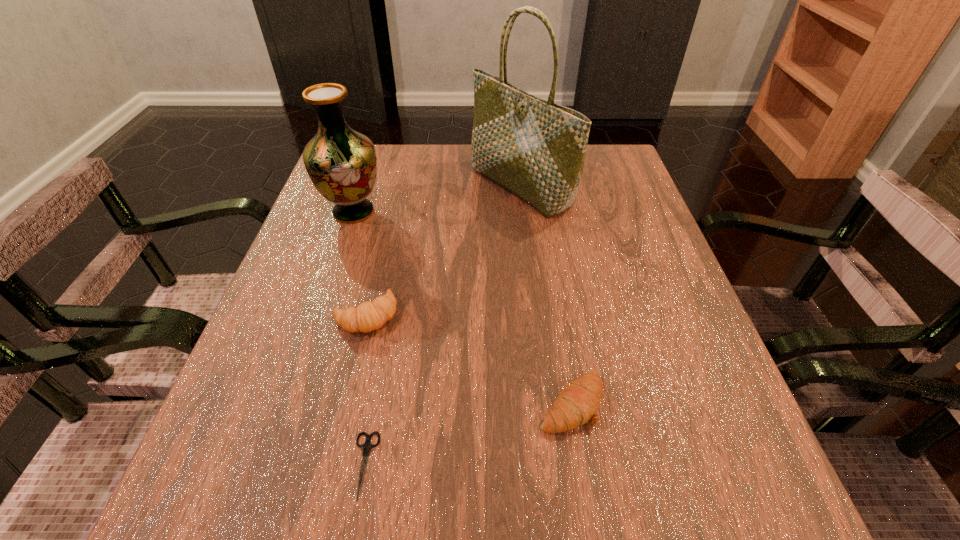
Locate an element on the screen. This screenshot has height=540, width=960. blank area located 0.230m on the left of the right crescent roll is located at coordinates coord(389,403).

Image resolution: width=960 pixels, height=540 pixels. What are the coordinates of `blank space located 0.280m on the back of the shortest object` in the screenshot? It's located at (x=396, y=293).

Identify the location of shopping bag situated at the far edge. The width and height of the screenshot is (960, 540). (534, 148).

Where is `vase at the far edge`? The image size is (960, 540). vase at the far edge is located at coordinates (341, 162).

Identify the location of object at the near edge. This screenshot has width=960, height=540. (366, 447).

At what (x,y) coordinates should I click in order to perform the action: click on vase at the left edge. Please return your answer as a coordinate pair (x, y). The height and width of the screenshot is (540, 960). Looking at the image, I should click on (341, 162).

Find the location of a particular element. The height and width of the screenshot is (540, 960). crescent roll at the left edge is located at coordinates (368, 316).

Locate an element on the screen. object that is positioned at the far left corner is located at coordinates 341,162.

Image resolution: width=960 pixels, height=540 pixels. What are the coordinates of `free point at the far edge` in the screenshot? It's located at [446, 163].

Locate an element on the screen. Image resolution: width=960 pixels, height=540 pixels. blank space at the near edge is located at coordinates (418, 507).